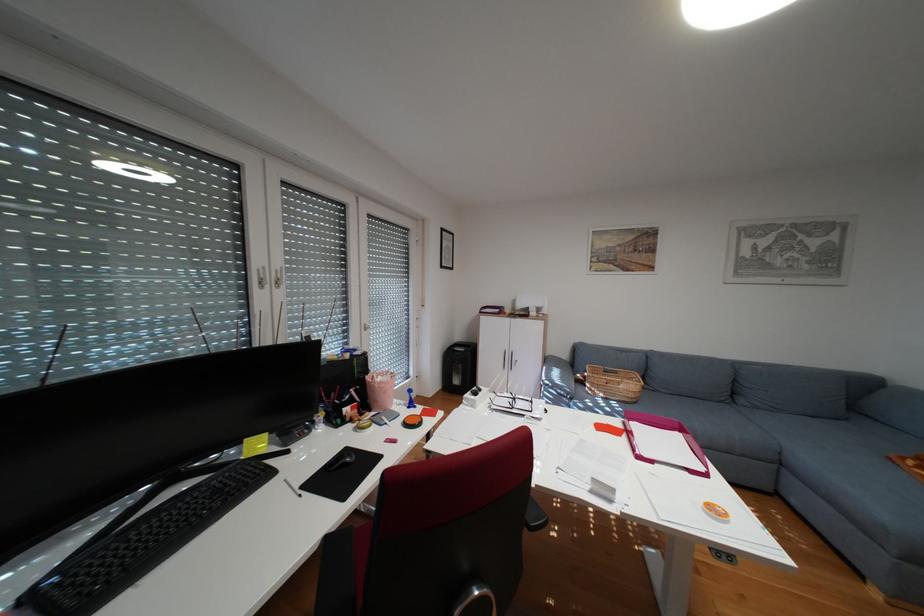
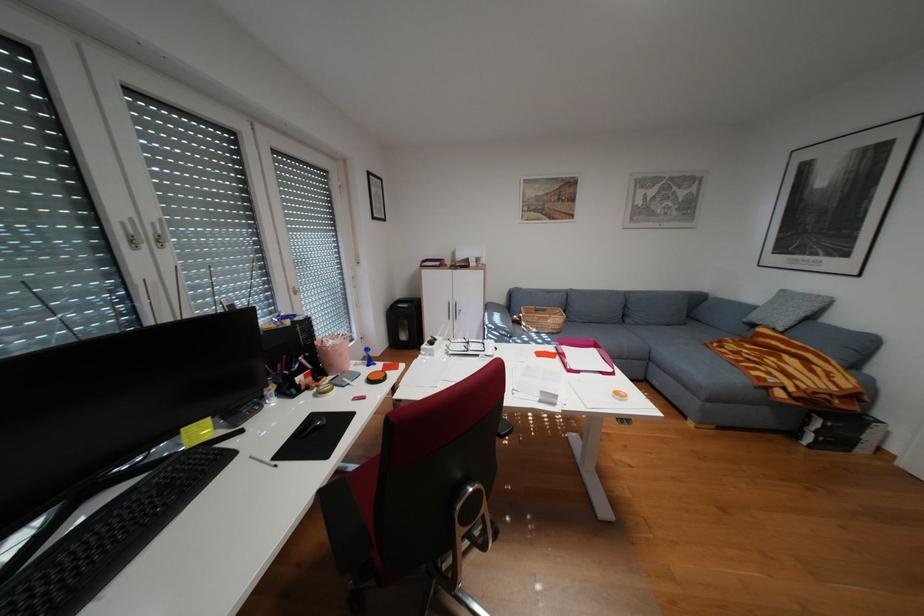
Find the pixel in the second image that matches pixel 492 392 in the first image.

(448, 342)